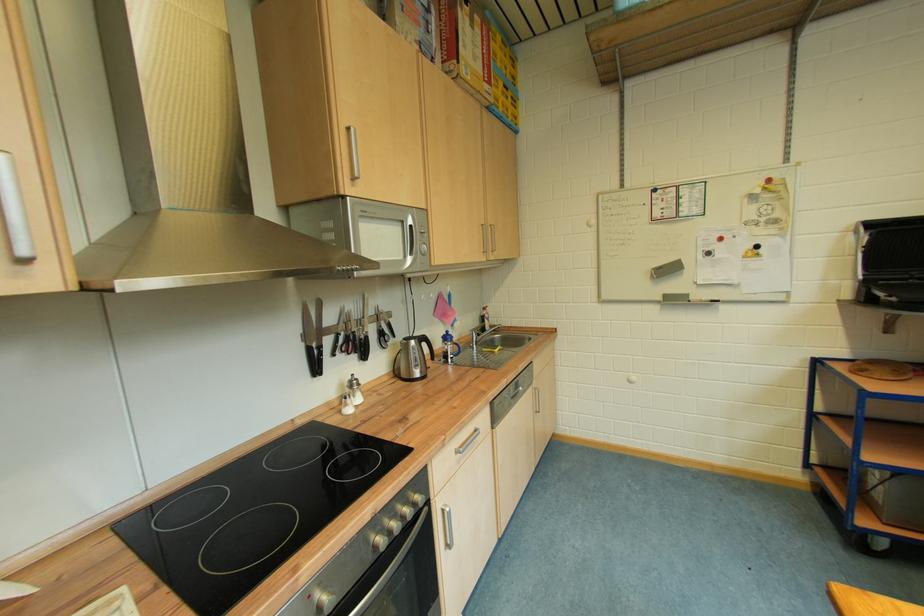
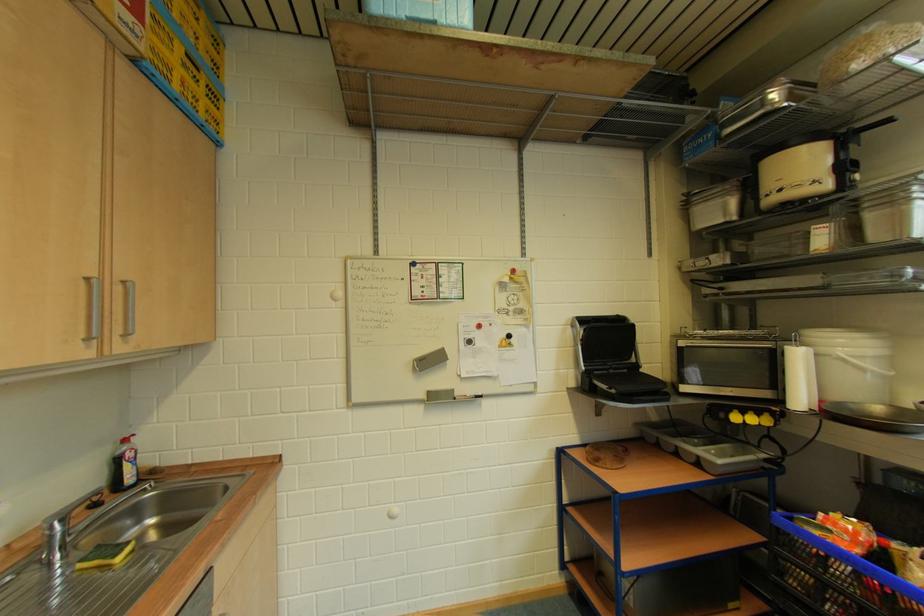
Where in the second image is the point corresponding to point (480, 339) from the first image?

(61, 539)